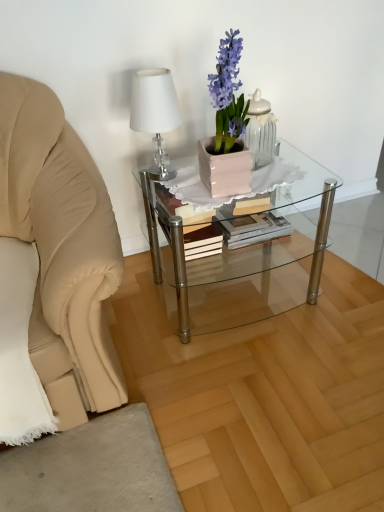
Locate an element on the screen. The image size is (384, 512). vacant space underneath clear glass coffee table at center (from a real-world perspective) is located at coordinates (239, 296).